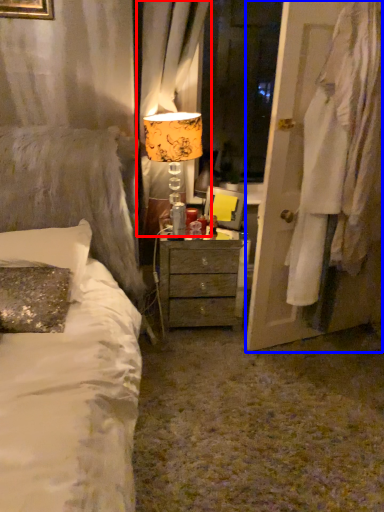
Question: Which object is further to the camera taking this photo, curtain (highlighted by a red box) or door (highlighted by a blue box)?

Choices:
 (A) curtain
 (B) door

Answer: (A)